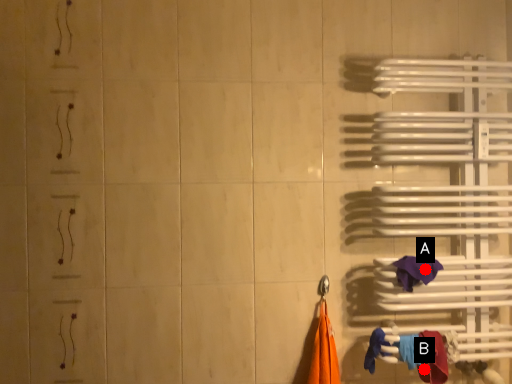
Question: Two points are circled on the image, labeled by A and B beside each circle. Which point is closer to the camera?

Choices:
 (A) A is closer
 (B) B is closer

Answer: (B)